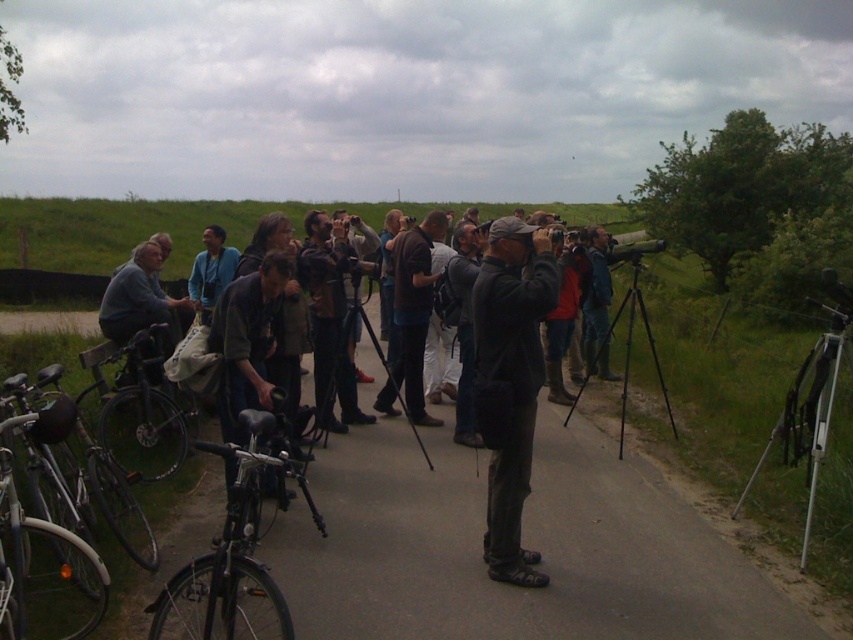
Is black metal tripod at center behind black matte tripod at center?

Yes, black metal tripod at center is further from the viewer.

At what (x,y) coordinates should I click in order to perform the action: click on black metal tripod at center. Please return your answer as a coordinate pair (x, y). The height and width of the screenshot is (640, 853). Looking at the image, I should click on (631, 340).

Locate an element on the screen. Image resolution: width=853 pixels, height=640 pixels. black metal tripod at center is located at coordinates (631, 340).

The width and height of the screenshot is (853, 640). I want to click on black metal tripod at center, so click(631, 340).

The width and height of the screenshot is (853, 640). I want to click on shiny black bicycle at left, so click(x=234, y=548).

Between black matte bicycle at left and silver metallic tripod at lower right, which one is positioned higher?

black matte bicycle at left is above.

Between black matte bicycle at left and silver metallic tripod at lower right, which one has more height?

silver metallic tripod at lower right

Does point (136, 416) come closer to viewer compared to point (827, 305)?

Yes, it is in front of point (827, 305).

This screenshot has width=853, height=640. In order to click on black matte bicycle at left in this screenshot , I will do `click(142, 416)`.